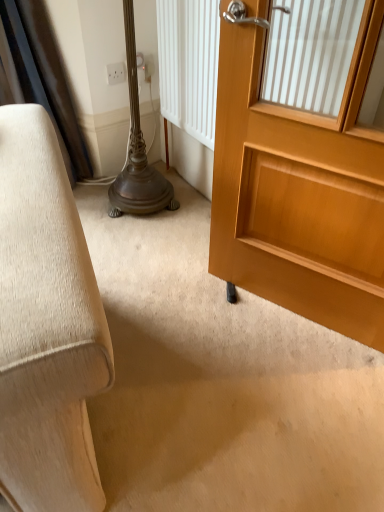
Question: Looking at their shapes, would you say light brown wooden door at right is wider or thinner than white plastic electric outlet at upper center?

Choices:
 (A) wide
 (B) thin

Answer: (A)

Question: Which is correct: light brown wooden door at right is inside white plastic electric outlet at upper center, or outside of it?

Choices:
 (A) outside
 (B) inside

Answer: (A)

Question: Looking at the image, does light brown wooden door at right seem bigger or smaller compared to white plastic electric outlet at upper center?

Choices:
 (A) small
 (B) big

Answer: (B)

Question: Would you say white plastic electric outlet at upper center is inside or outside light brown wooden door at right?

Choices:
 (A) inside
 (B) outside

Answer: (B)

Question: Is white plastic electric outlet at upper center bigger or smaller than light brown wooden door at right?

Choices:
 (A) big
 (B) small

Answer: (B)

Question: Considering the positions of point (114, 81) and point (342, 241), is point (114, 81) closer or farther from the camera than point (342, 241)?

Choices:
 (A) farther
 (B) closer

Answer: (A)

Question: From the image's perspective, is white plastic electric outlet at upper center located above or below light brown wooden door at right?

Choices:
 (A) below
 (B) above

Answer: (B)